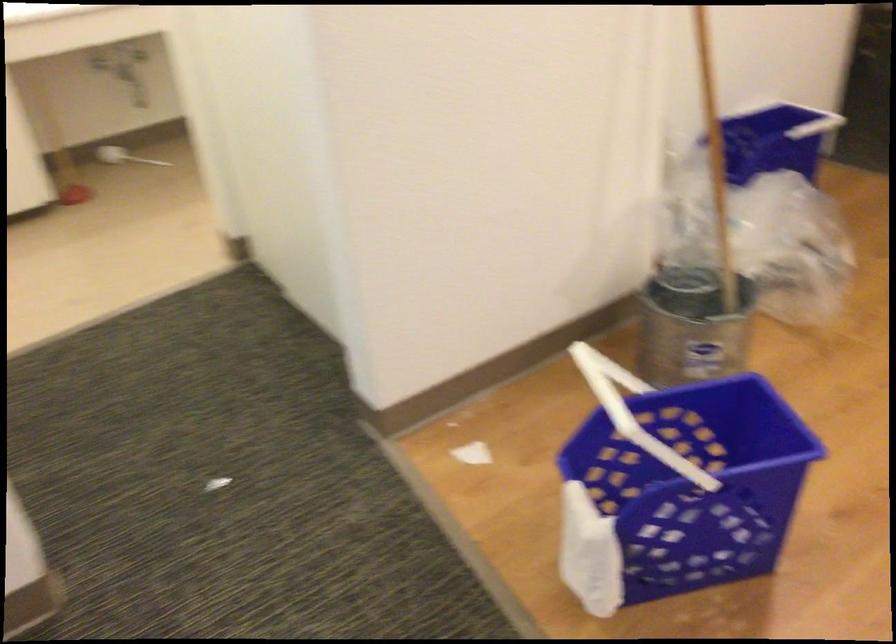
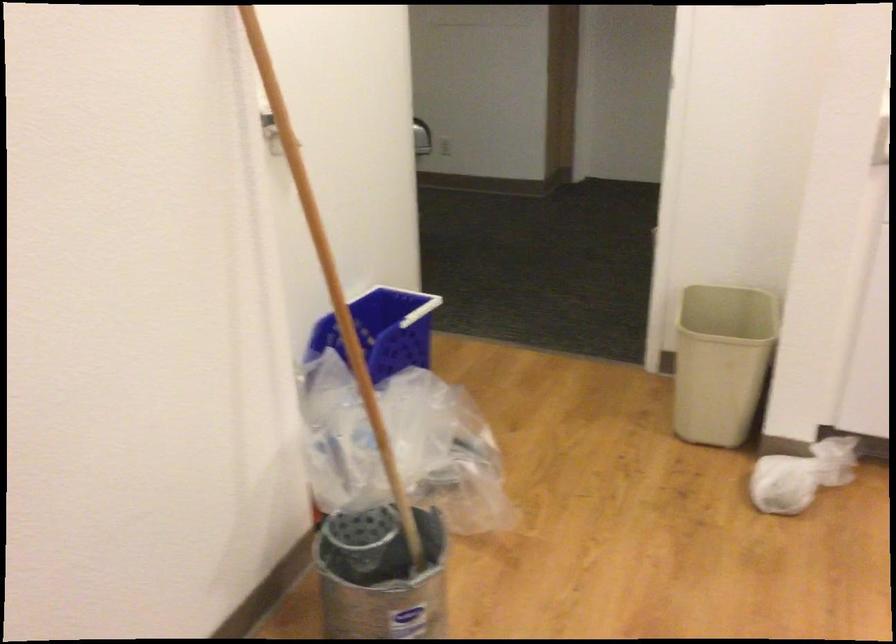
The point at (787, 125) is marked in the first image. Where is the corresponding point in the second image?

(407, 303)